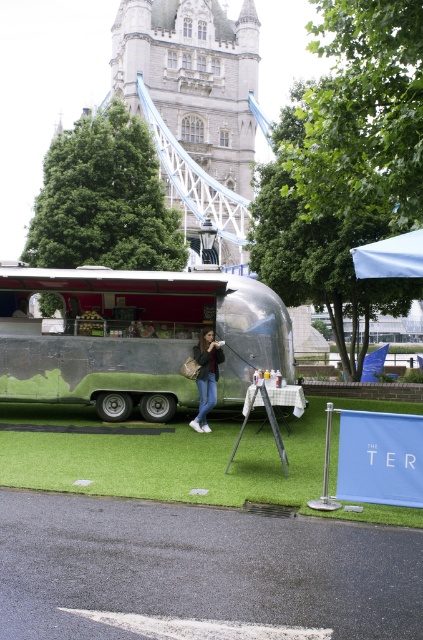
You are standing at the entrance of the vintage food trailer and want to place a small picnic basket on the green artificial turf at center. Based on the coordinates provided, where exactly should you place the basket?

The green artificial turf at center is located at coordinates point (175, 461), so you should place the basket at that exact point.

You are a customer standing at the entrance of the food area. You see the silver metallic trailer at center and the white fabric canopy at upper right. Which object is positioned higher in the scene?

The white fabric canopy at upper right is positioned higher than the silver metallic trailer at center.

You are standing in front of the vintage food trailer and want to know which of the two points, point (321, 445) or point (415, 252), is closer to you. Can you determine this based on their positions?

Point (321, 445) is closer to you because it is further to the viewer than point (415, 252).